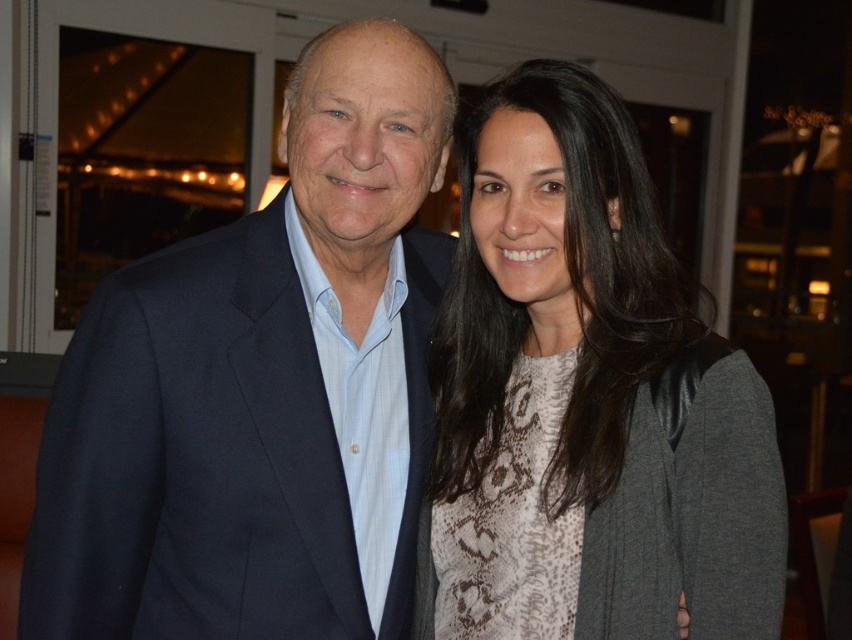
From the picture: You are a photographer setting up for an indoor event. You need to position a spotlight that can cover both the navy blue suit at left and the snake print sweater at center. Since the spotlight has a fixed height, which object should you aim the spotlight at to ensure both are illuminated properly?

The navy blue suit at left is taller than the snake print sweater at center, so you should aim the spotlight at the navy blue suit at left to ensure both are illuminated properly.

You are at a social event and need to find the navy blue suit at left and the snake print sweater at center. Which one is located more to the left side?

The navy blue suit at left is more on the left side.